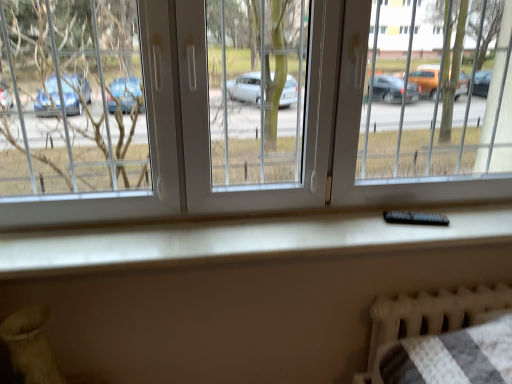
Question: From the image's perspective, is transparent plastic window at center beneath black plastic remote at center?

Choices:
 (A) yes
 (B) no

Answer: (B)

Question: Considering the relative sizes of transparent plastic window at center and black plastic remote at center in the image provided, is transparent plastic window at center shorter than black plastic remote at center?

Choices:
 (A) no
 (B) yes

Answer: (A)

Question: From the image's perspective, would you say transparent plastic window at center is positioned over black plastic remote at center?

Choices:
 (A) yes
 (B) no

Answer: (A)

Question: Is black plastic remote at center surrounded by transparent plastic window at center?

Choices:
 (A) no
 (B) yes

Answer: (B)

Question: Is transparent plastic window at center facing towards black plastic remote at center?

Choices:
 (A) no
 (B) yes

Answer: (A)

Question: In terms of width, does white textured radiator at lower right look wider or thinner when compared to black plastic remote at center?

Choices:
 (A) wide
 (B) thin

Answer: (A)

Question: Is white textured radiator at lower right to the left or to the right of black plastic remote at center in the image?

Choices:
 (A) left
 (B) right

Answer: (B)

Question: Relative to black plastic remote at center, is white textured radiator at lower right in front or behind?

Choices:
 (A) behind
 (B) front

Answer: (A)

Question: From a real-world perspective, is white textured radiator at lower right physically located above or below black plastic remote at center?

Choices:
 (A) above
 (B) below

Answer: (B)

Question: Is transparent plastic window at center in front of or behind black plastic remote at center in the image?

Choices:
 (A) behind
 (B) front

Answer: (B)

Question: Visually, is transparent plastic window at center positioned to the left or to the right of black plastic remote at center?

Choices:
 (A) right
 (B) left

Answer: (B)

Question: Is transparent plastic window at center situated inside black plastic remote at center or outside?

Choices:
 (A) outside
 (B) inside

Answer: (A)

Question: Looking at their shapes, would you say transparent plastic window at center is wider or thinner than black plastic remote at center?

Choices:
 (A) wide
 (B) thin

Answer: (A)

Question: Considering the positions of black plastic remote at center and white textured radiator at lower right in the image, is black plastic remote at center bigger or smaller than white textured radiator at lower right?

Choices:
 (A) big
 (B) small

Answer: (B)

Question: Is black plastic remote at center to the left or to the right of white textured radiator at lower right in the image?

Choices:
 (A) left
 (B) right

Answer: (A)